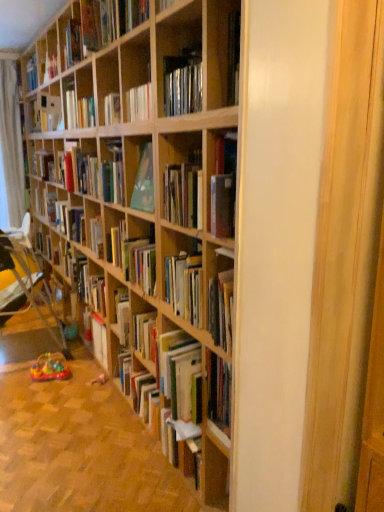
Question: From a real-world perspective, is matte red book at center, which is counted as the 3th book, starting from the bottom, positioned over wooden folding chair at lower left based on gravity?

Choices:
 (A) yes
 (B) no

Answer: (A)

Question: Is matte red book at center, which is counted as the 3th book, starting from the bottom, further to the viewer compared to wooden folding chair at lower left?

Choices:
 (A) no
 (B) yes

Answer: (B)

Question: Does matte red book at center, which is counted as the 3th book, starting from the bottom, have a larger size compared to wooden folding chair at lower left?

Choices:
 (A) yes
 (B) no

Answer: (B)

Question: Considering the relative sizes of matte red book at center, which is counted as the 3th book, starting from the bottom, and wooden folding chair at lower left in the image provided, is matte red book at center, which is counted as the 3th book, starting from the bottom, smaller than wooden folding chair at lower left?

Choices:
 (A) no
 (B) yes

Answer: (B)

Question: Is matte red book at center, the second book from the top, far away from wooden folding chair at lower left?

Choices:
 (A) no
 (B) yes

Answer: (B)

Question: Do you think hardcover book at center, which appears as the second book when ordered from the bottom, is within wooden bookcase at center, or outside of it?

Choices:
 (A) inside
 (B) outside

Answer: (B)

Question: Is hardcover book at center, the third book when ordered from top to bottom, wider or thinner than wooden bookcase at center?

Choices:
 (A) thin
 (B) wide

Answer: (B)

Question: Is point (145, 265) positioned closer to the camera than point (119, 96)?

Choices:
 (A) farther
 (B) closer

Answer: (B)

Question: From the image's perspective, is hardcover book at center, the third book when ordered from top to bottom, located above or below wooden bookcase at center?

Choices:
 (A) below
 (B) above

Answer: (B)

Question: From a real-world perspective, is white sheer curtain at left positioned above or below hardcover book at center, which appears as the second book when ordered from the bottom?

Choices:
 (A) below
 (B) above

Answer: (B)

Question: Considering the positions of white sheer curtain at left and hardcover book at center, which appears as the second book when ordered from the bottom, in the image, is white sheer curtain at left wider or thinner than hardcover book at center, which appears as the second book when ordered from the bottom,?

Choices:
 (A) thin
 (B) wide

Answer: (B)

Question: Considering the relative positions of white sheer curtain at left and hardcover book at center, the third book when ordered from top to bottom, in the image provided, is white sheer curtain at left to the left or to the right of hardcover book at center, the third book when ordered from top to bottom,?

Choices:
 (A) left
 (B) right

Answer: (A)

Question: Considering the positions of white sheer curtain at left and hardcover book at center, the third book when ordered from top to bottom, in the image, is white sheer curtain at left taller or shorter than hardcover book at center, the third book when ordered from top to bottom,?

Choices:
 (A) tall
 (B) short

Answer: (A)

Question: Would you say wooden bookcase at center is inside or outside hardcover book at center, the fourth book in the top-to-bottom sequence?

Choices:
 (A) outside
 (B) inside

Answer: (A)

Question: From the image's perspective, relative to hardcover book at center, the fourth book in the top-to-bottom sequence, is wooden bookcase at center above or below?

Choices:
 (A) below
 (B) above

Answer: (B)